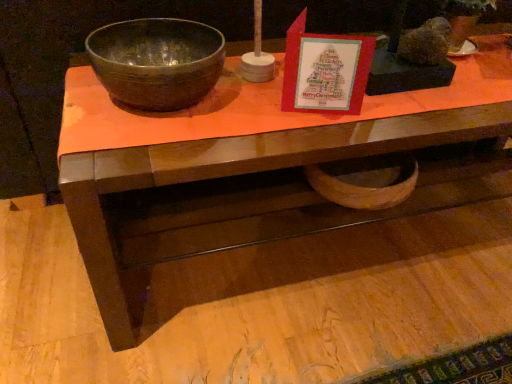
The height and width of the screenshot is (384, 512). I want to click on vacant area situated below wooden desk at center (from a real-world perspective), so click(323, 243).